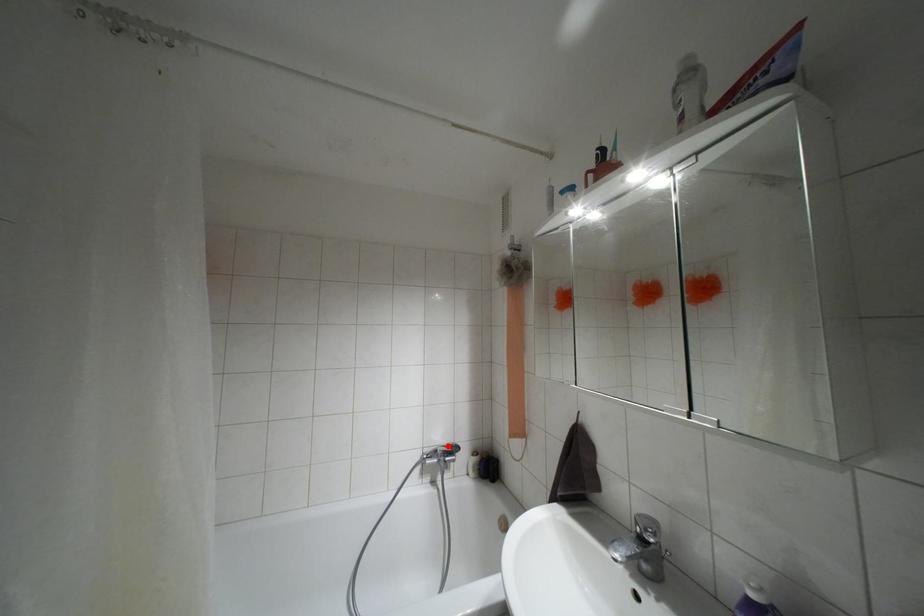
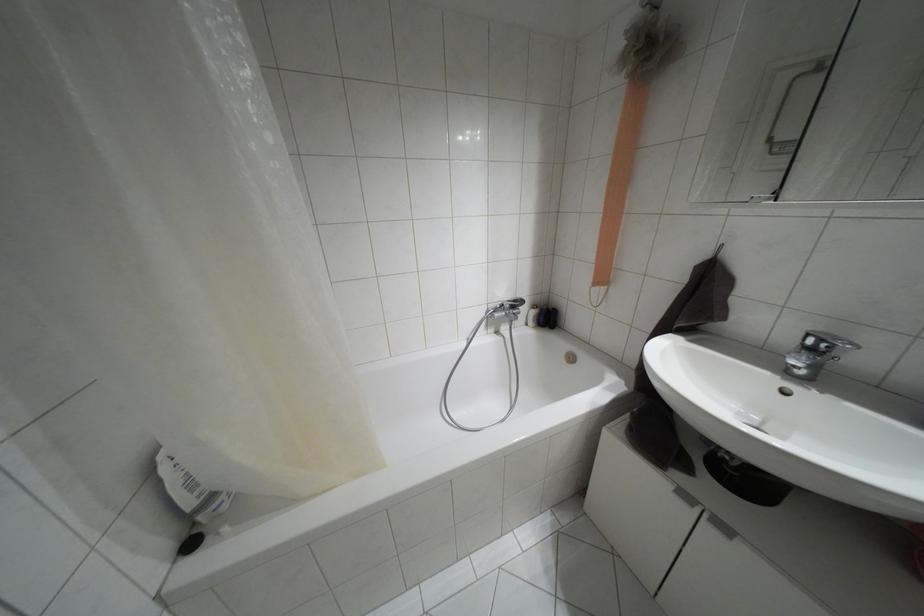
Find the pixel in the second image that matches the highlighted location in the first image.

(514, 301)